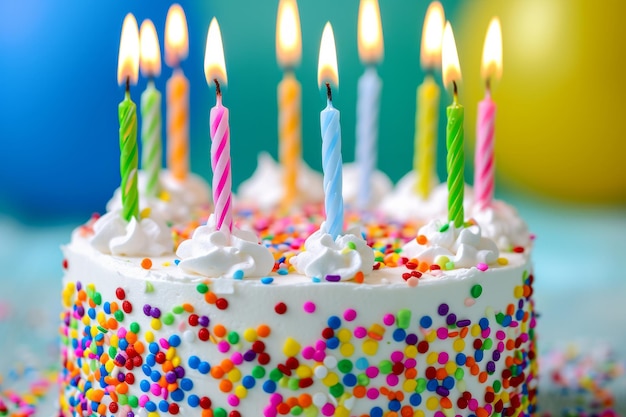
I want to click on candle wicks, so click(126, 88), click(151, 78), click(178, 64), click(218, 92), click(289, 65), click(330, 95), click(372, 62), click(431, 71), click(454, 90), click(486, 88).